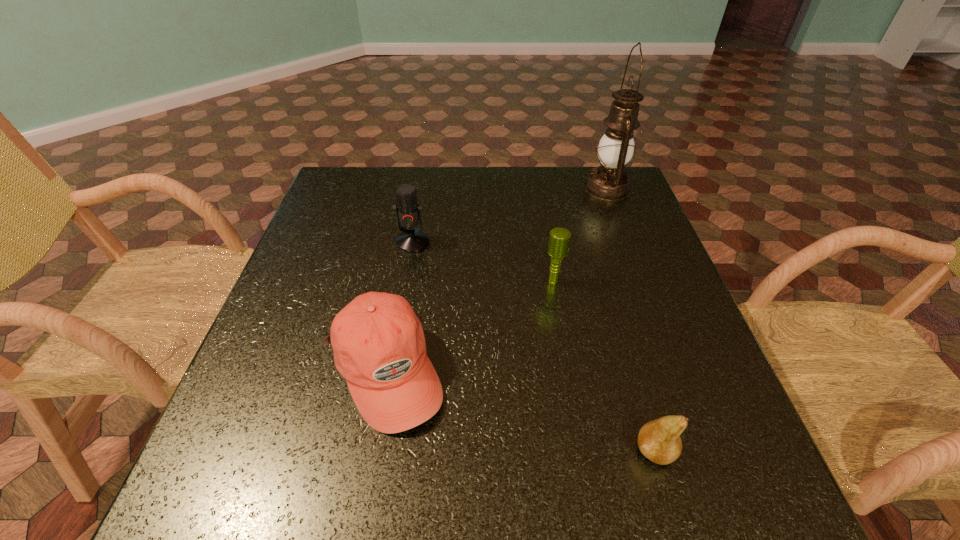
Identify the location of the farthest object. (609, 182).

Locate an element on the screen. the tallest object is located at coordinates (609, 182).

Locate an element on the screen. The width and height of the screenshot is (960, 540). the second farthest object is located at coordinates click(407, 208).

Identify the location of the left microphone. (407, 208).

Where is `the third object from left to right`? the third object from left to right is located at coordinates (559, 239).

I want to click on the right microphone, so click(559, 239).

Find the location of `baseball cap`. baseball cap is located at coordinates (379, 346).

At what (x,y) coordinates should I click in order to perform the action: click on the shortest object. Please return your answer as a coordinate pair (x, y). The height and width of the screenshot is (540, 960). Looking at the image, I should click on (659, 440).

This screenshot has height=540, width=960. I want to click on vacant space located on the front of the oil lamp, so click(637, 270).

At what (x,y) coordinates should I click in order to perform the action: click on vacant space located on the side of the left microphone with the red ring. Please return your answer as a coordinate pair (x, y). The width and height of the screenshot is (960, 540). Looking at the image, I should click on (409, 267).